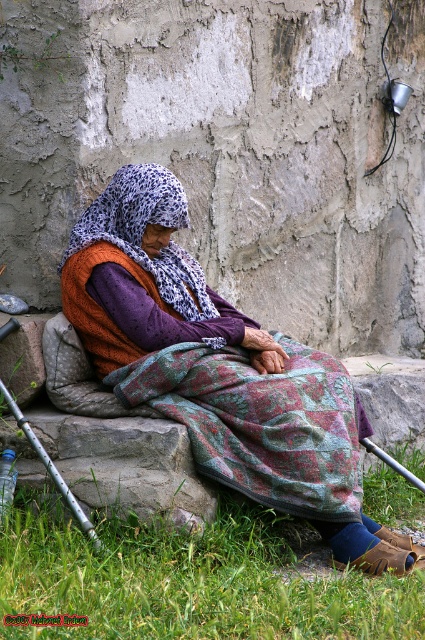
Can you confirm if patterned fabric headscarf at center is smaller than floral woven blanket at lower center?

No, patterned fabric headscarf at center is not smaller than floral woven blanket at lower center.

Identify the location of patterned fabric headscarf at center. The image size is (425, 640). (218, 368).

Does patterned fabric headscarf at center lie behind green grass at lower center?

Yes, it is behind green grass at lower center.

Who is more distant from viewer, (x=197, y=440) or (x=88, y=595)?

The point (x=197, y=440) is more distant.

The width and height of the screenshot is (425, 640). In order to click on patterned fabric headscarf at center in this screenshot , I will do `click(218, 368)`.

Find the location of a particular element. Image resolution: width=425 pixels, height=640 pixels. patterned fabric headscarf at center is located at coordinates 218,368.

Can you confirm if gray rough stone at lower left is wider than floral fabric shawl at center?

Correct, the width of gray rough stone at lower left exceeds that of floral fabric shawl at center.

Which is below, gray rough stone at lower left or floral fabric shawl at center?

gray rough stone at lower left is below.

Between point (119, 497) and point (180, 211), which one is positioned in front?

Point (119, 497) is more forward.

Identify the location of gray rough stone at lower left. The width and height of the screenshot is (425, 640). (127, 465).